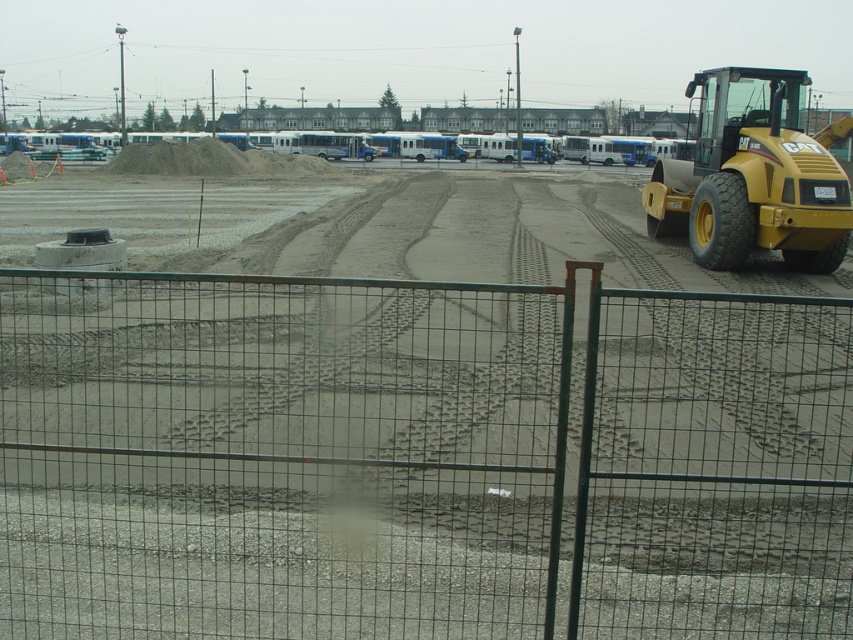
You are a delivery driver who needs to enter the construction site through the green wire mesh fence at center. However, there is a yellow rubber tractor at right blocking the entrance. Can you drive your truck through the gap between them?

The green wire mesh fence at center is larger in size than the yellow rubber tractor at right, so the gap between them might be narrow. However, without specific measurements, it is uncertain if your truck can pass safely. It is recommended to assess the space or seek assistance from the site supervisor.

You are standing at the center of the construction site and see the point marked at coordinates (419, 460). What object is located at that point?

The point at coordinates (419, 460) corresponds to the green wire mesh fence at center.

You are a delivery driver who needs to back up your truck to the loading dock. There is a green wire mesh fence at center and a yellow rubber tractor at right in your way. Can you safely back up your truck without hitting any obstacles if your truck requires 30 feet of space to maneuver?

The distance between the green wire mesh fence at center and the yellow rubber tractor at right is 26.73 feet, which is less than the 30 feet required for your truck to maneuver safely. Therefore, you cannot safely back up without hitting an obstacle.